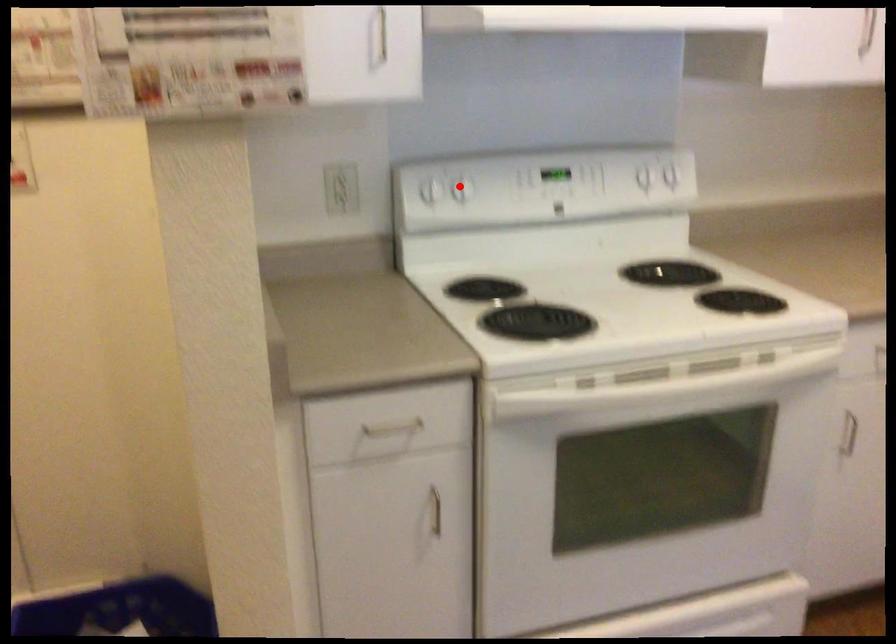
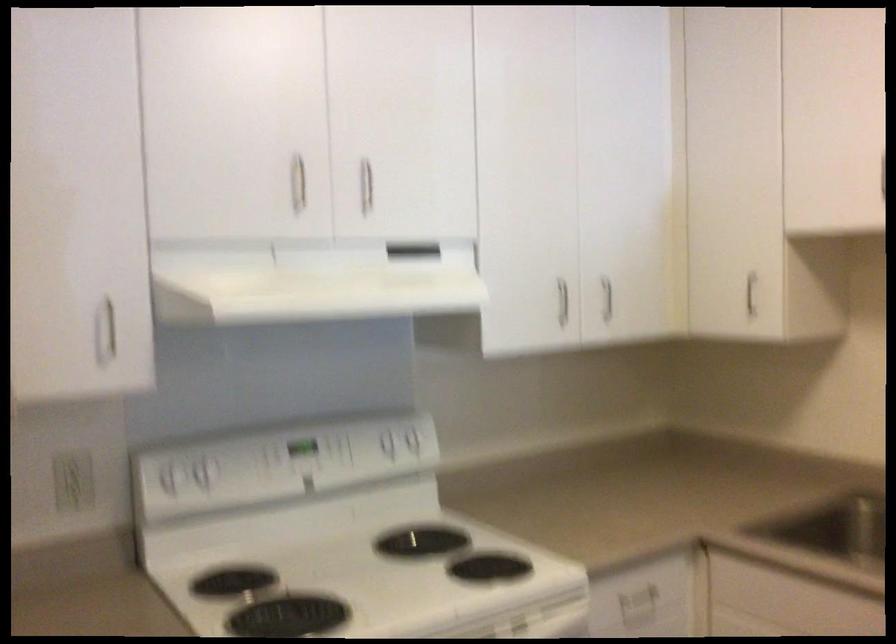
In the second image, find the point that corresponds to the highlighted location in the first image.

(200, 474)